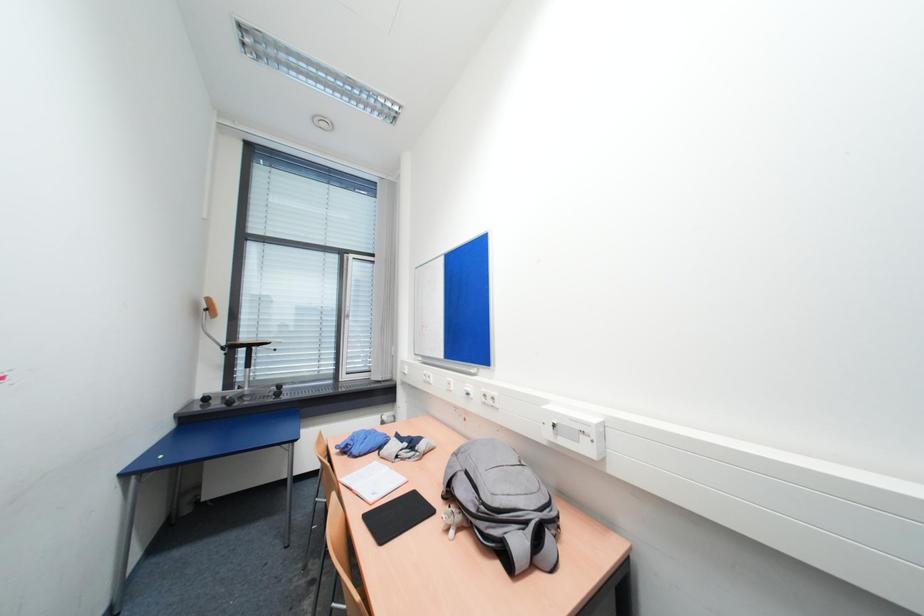
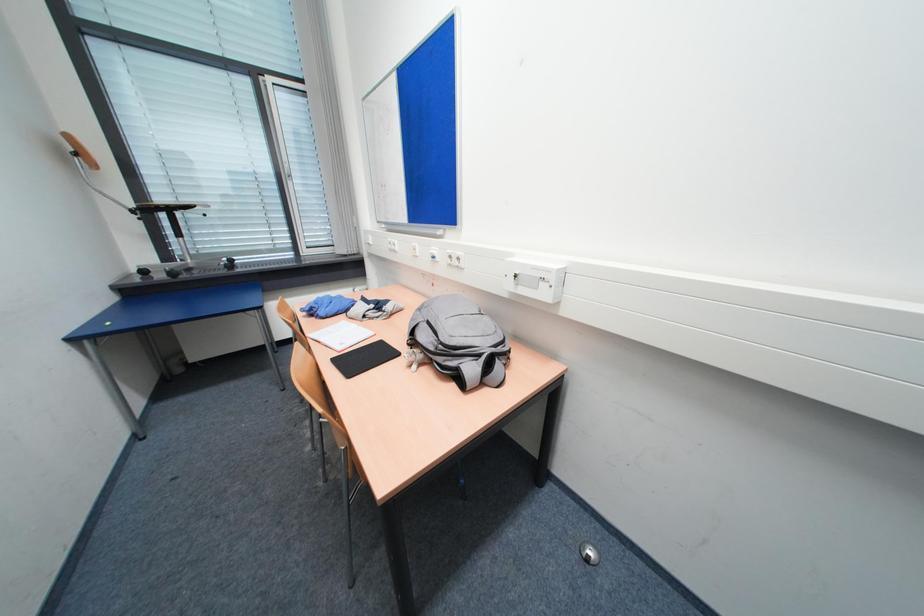
The images are taken continuously from a first-person perspective. In which direction are you moving?

The cameraman walked toward right, forward.